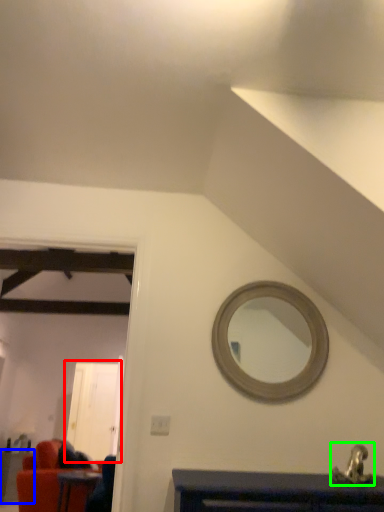
Question: Considering the real-world distances, which object is farthest from glass door (highlighted by a red box)? table (highlighted by a blue box) or sink (highlighted by a green box)?

Choices:
 (A) table
 (B) sink

Answer: (B)